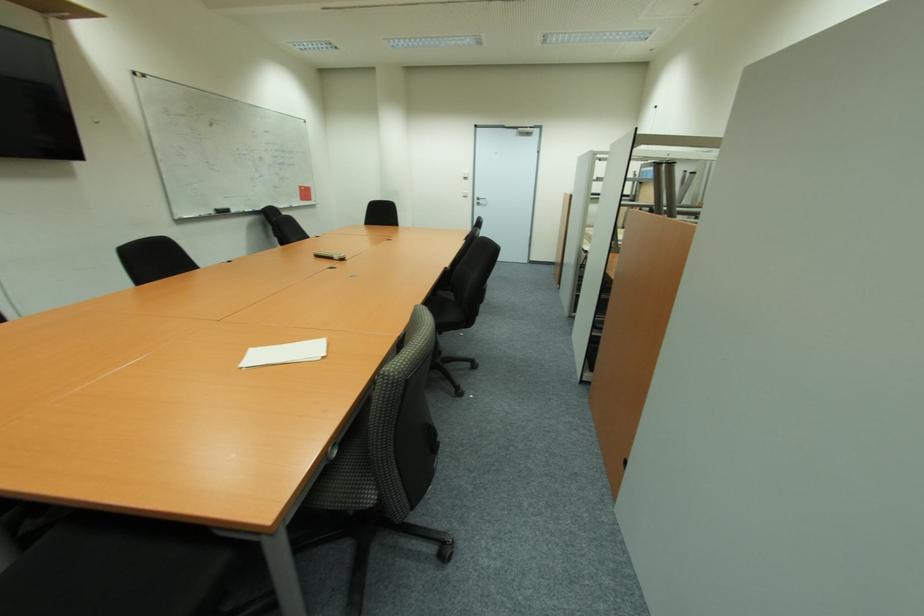
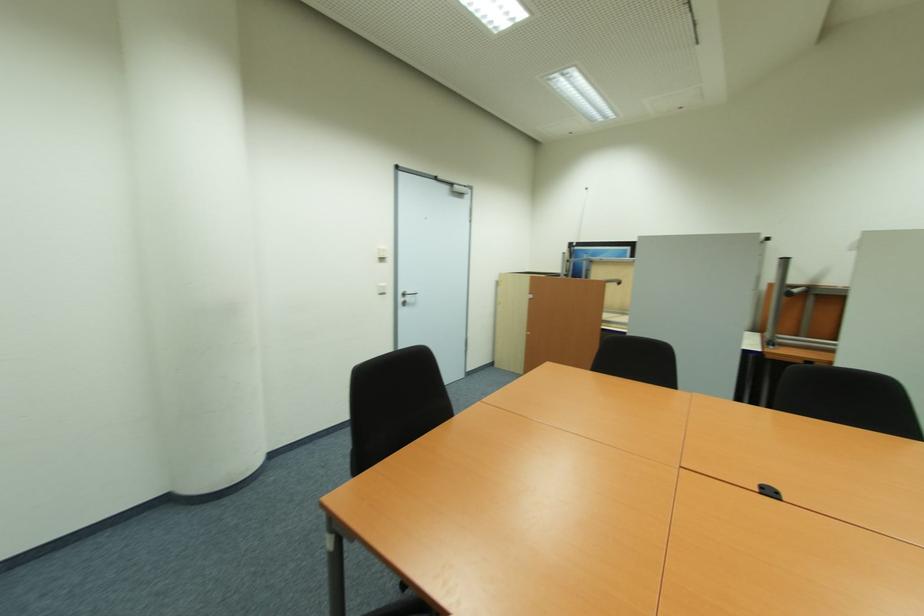
In the second image, find the point that corresponds to point 480,201 in the first image.

(405, 300)